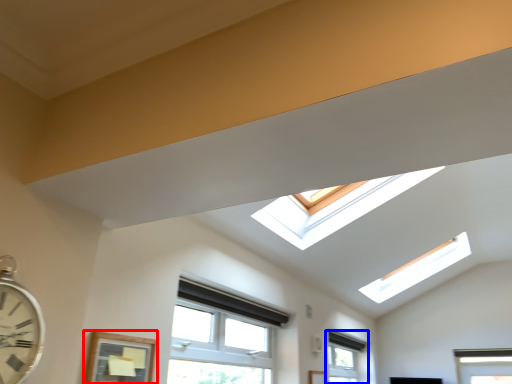
Question: Which of the following is the farthest to the observer, window (highlighted by a red box) or window (highlighted by a blue box)?

Choices:
 (A) window
 (B) window

Answer: (B)